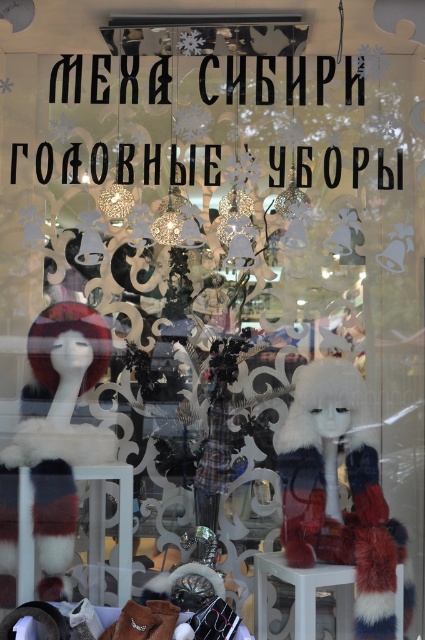
Question: Which point is closer to the camera?

Choices:
 (A) (260, 588)
 (B) (380, 566)

Answer: (B)

Question: Based on their relative distances, which object is farther from the velvet red hat at left?

Choices:
 (A) white glossy stool at center
 (B) white fur hat at center

Answer: (A)

Question: From the image, what is the correct spatial relationship of white fur hat at center in relation to white glossy stool at center?

Choices:
 (A) right
 (B) left

Answer: (A)

Question: Can you confirm if velvet red hat at left is smaller than white glossy stool at center?

Choices:
 (A) no
 (B) yes

Answer: (A)

Question: Does white fur hat at center lie in front of white glossy stool at center?

Choices:
 (A) yes
 (B) no

Answer: (B)

Question: Which object is farther from the camera taking this photo?

Choices:
 (A) white glossy stool at center
 (B) white fur hat at center

Answer: (B)